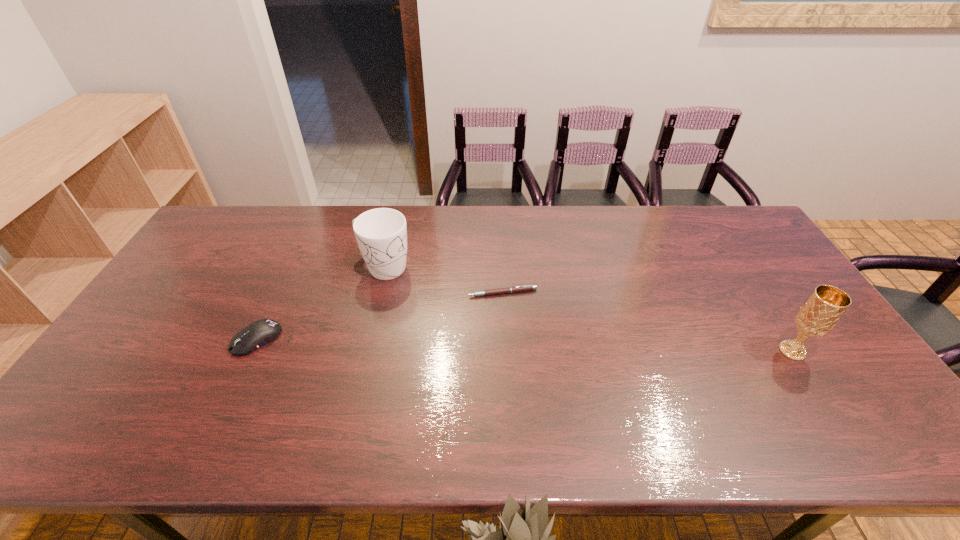
This screenshot has height=540, width=960. I want to click on free space on the desktop that is between the third tallest object and the chalice and is positioned at the nib of the third nearest object, so click(473, 344).

Where is `free space on the desktop that is between the leftmost object and the rightmost object and is positioned on the side of the mug with the handle`? free space on the desktop that is between the leftmost object and the rightmost object and is positioned on the side of the mug with the handle is located at coordinates (506, 345).